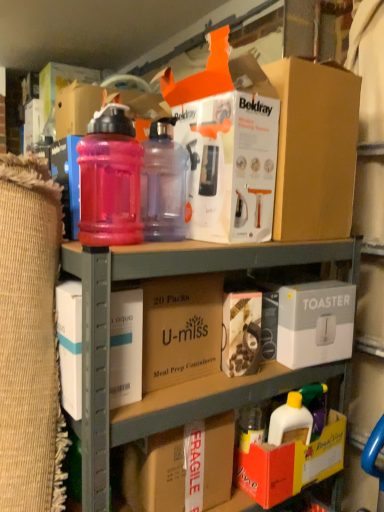
Question: From the image's perspective, does fragile cardboard box at lower center, acting as the first cardboard box starting from the bottom, appear lower than brown cardboard at center, which is counted as the 2th cardboard box, starting from the bottom?

Choices:
 (A) yes
 (B) no

Answer: (A)

Question: From the image's perspective, is fragile cardboard box at lower center, which appears as the 2th cardboard box when viewed from the top, on brown cardboard at center, which is counted as the 2th cardboard box, starting from the bottom?

Choices:
 (A) yes
 (B) no

Answer: (B)

Question: Does fragile cardboard box at lower center, acting as the first cardboard box starting from the bottom, turn towards brown cardboard at center, which is counted as the 2th cardboard box, starting from the bottom?

Choices:
 (A) yes
 (B) no

Answer: (B)

Question: Is fragile cardboard box at lower center, acting as the first cardboard box starting from the bottom, shorter than brown cardboard at center, which is counted as the 2th cardboard box, starting from the bottom?

Choices:
 (A) yes
 (B) no

Answer: (A)

Question: Would you say fragile cardboard box at lower center, acting as the first cardboard box starting from the bottom, is outside brown cardboard at center, the 1th cardboard box from the top?

Choices:
 (A) yes
 (B) no

Answer: (A)

Question: Is brown cardboard at center, which is counted as the 2th cardboard box, starting from the bottom, spatially inside fragile cardboard box at lower center, which appears as the 2th cardboard box when viewed from the top, or outside of it?

Choices:
 (A) inside
 (B) outside

Answer: (B)

Question: Looking at the image, does brown cardboard at center, the 1th cardboard box from the top, seem bigger or smaller compared to fragile cardboard box at lower center, acting as the first cardboard box starting from the bottom?

Choices:
 (A) small
 (B) big

Answer: (B)

Question: Would you say brown cardboard at center, the 1th cardboard box from the top, is to the left or to the right of fragile cardboard box at lower center, acting as the first cardboard box starting from the bottom, in the picture?

Choices:
 (A) left
 (B) right

Answer: (A)

Question: In the image, is brown cardboard at center, the 1th cardboard box from the top, positioned in front of or behind fragile cardboard box at lower center, acting as the first cardboard box starting from the bottom?

Choices:
 (A) behind
 (B) front

Answer: (B)

Question: Is pink translucent bottle at upper center, which appears as the 2th bottle when viewed from the left, situated inside fragile cardboard box at lower center, which appears as the 2th cardboard box when viewed from the top, or outside?

Choices:
 (A) outside
 (B) inside

Answer: (A)

Question: From the image's perspective, is pink translucent bottle at upper center, which appears as the 2th bottle when viewed from the left, above or below fragile cardboard box at lower center, which appears as the 2th cardboard box when viewed from the top?

Choices:
 (A) below
 (B) above

Answer: (B)

Question: Considering the positions of pink translucent bottle at upper center, which is the first bottle in right-to-left order, and fragile cardboard box at lower center, acting as the first cardboard box starting from the bottom, in the image, is pink translucent bottle at upper center, which is the first bottle in right-to-left order, wider or thinner than fragile cardboard box at lower center, acting as the first cardboard box starting from the bottom,?

Choices:
 (A) wide
 (B) thin

Answer: (B)

Question: Is point pyautogui.click(x=158, y=132) positioned closer to the camera than point pyautogui.click(x=220, y=449)?

Choices:
 (A) closer
 (B) farther

Answer: (A)

Question: Which is correct: pink plastic bottles at upper center is inside translucent pink bottle at upper left, which is the second bottle in right-to-left order, or outside of it?

Choices:
 (A) outside
 (B) inside

Answer: (A)

Question: From a real-world perspective, is pink plastic bottles at upper center physically located above or below translucent pink bottle at upper left, acting as the 1th bottle starting from the left?

Choices:
 (A) below
 (B) above

Answer: (A)